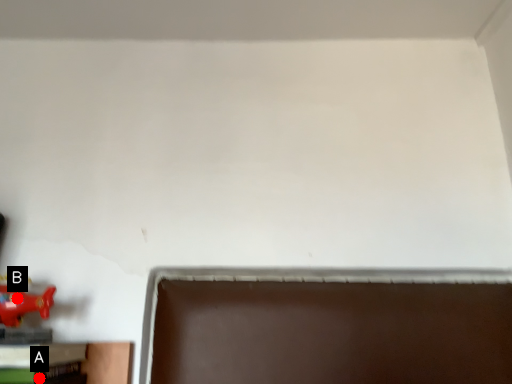
Question: Two points are circled on the image, labeled by A and B beside each circle. Among these points, which one is nearest to the camera?

Choices:
 (A) A is closer
 (B) B is closer

Answer: (A)